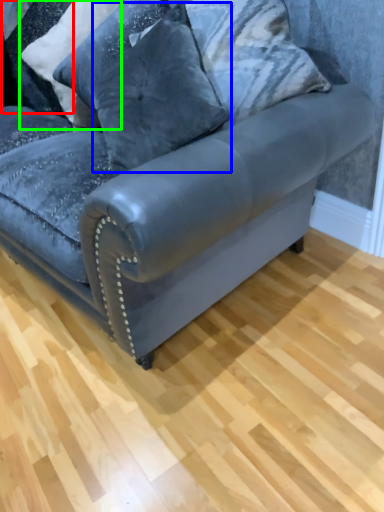
Question: Which object is the farthest from pillow (highlighted by a red box)? Choose among these: pillow (highlighted by a blue box) or pillow (highlighted by a green box).

Choices:
 (A) pillow
 (B) pillow

Answer: (A)